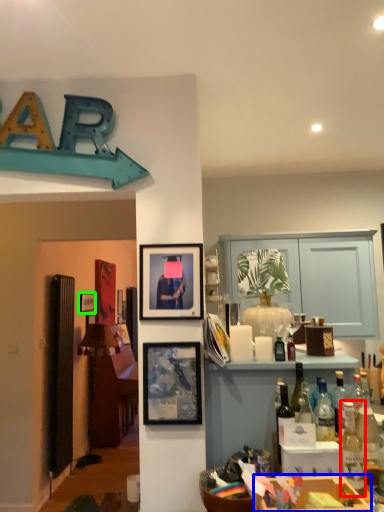
Question: Considering the real-world distances, which object is closest to bottle (highlighted by a red box)? cabinetry (highlighted by a blue box) or picture frame (highlighted by a green box).

Choices:
 (A) cabinetry
 (B) picture frame

Answer: (A)